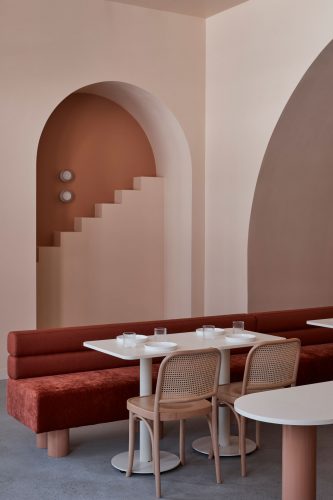
The height and width of the screenshot is (500, 333). Find the location of `floor`. floor is located at coordinates (85, 472).